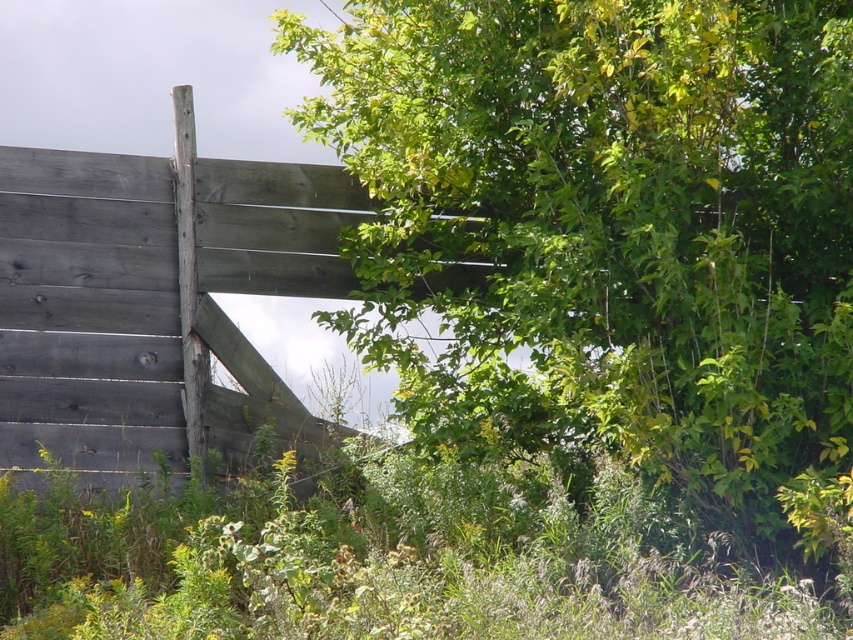
Which is more to the left, green leafy tree at upper center or weathered gray wood at upper left?

Positioned to the left is weathered gray wood at upper left.

Is point (456, 124) positioned behind point (141, 420)?

No, (456, 124) is in front of (141, 420).

Find the location of a particular element. The height and width of the screenshot is (640, 853). green leafy tree at upper center is located at coordinates (616, 216).

This screenshot has height=640, width=853. Identify the location of green leafy tree at upper center. (616, 216).